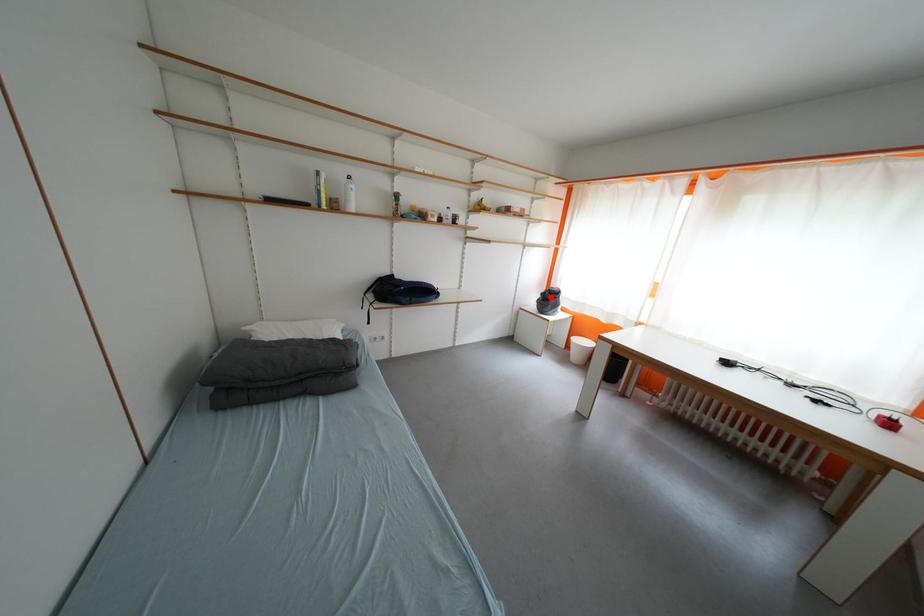
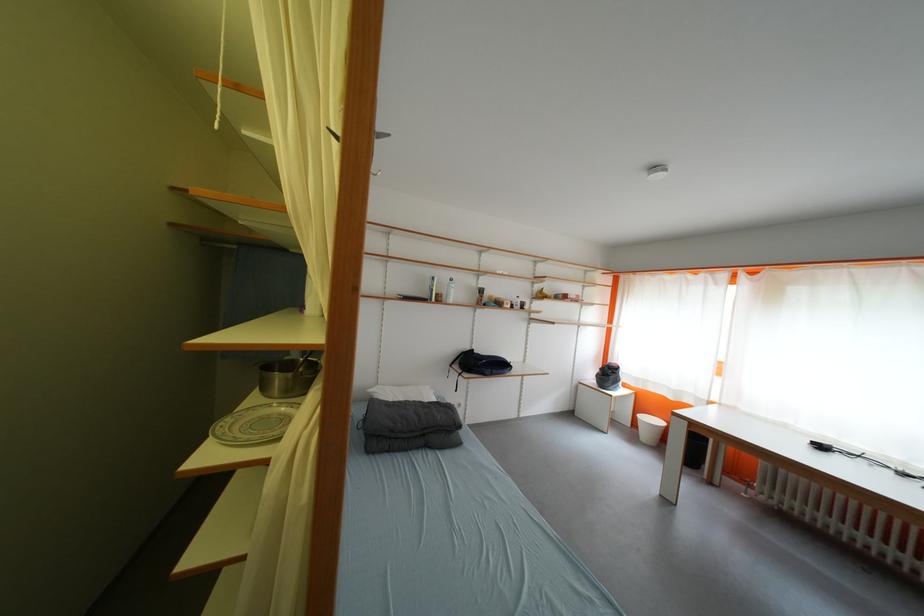
Question: I am providing you with two images of the same scene from different viewpoints. In image1, a red point is highlighted. Considering the same 3D point in image2, which of the following is correct?

Choices:
 (A) It is closer
 (B) It is farther

Answer: (B)